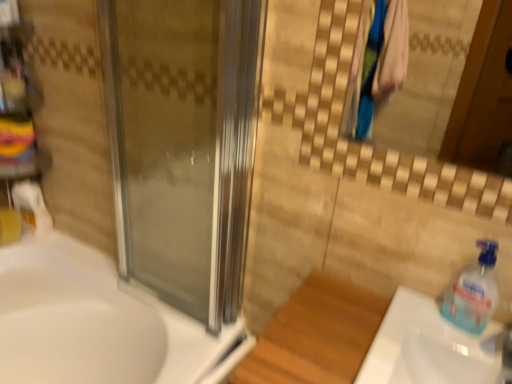
Describe the element at coordinates (430, 347) in the screenshot. This screenshot has width=512, height=384. I see `white glossy sink at lower right, the second sink in the back-to-front sequence` at that location.

I want to click on white glossy sink at lower right, which is counted as the 2th sink, starting from the left, so point(430,347).

The width and height of the screenshot is (512, 384). Describe the element at coordinates (472, 292) in the screenshot. I see `transparent plastic soap dispenser at right` at that location.

I want to click on transparent plastic soap dispenser at right, so click(x=472, y=292).

What do you see at coordinates (98, 323) in the screenshot? The height and width of the screenshot is (384, 512). I see `white glossy sink at lower left, arranged as the 2th sink when viewed from the right` at bounding box center [98, 323].

Locate an element on the screen. Image resolution: width=512 pixels, height=384 pixels. white glossy sink at lower right, the 1th sink in the right-to-left sequence is located at coordinates (430, 347).

Between white glossy sink at lower left, which is the second sink from front to back, and transparent glass screen door at center, which one is positioned in front?

Positioned in front is transparent glass screen door at center.

Does white glossy sink at lower left, the 1th sink in the left-to-right sequence, have a larger size compared to transparent glass screen door at center?

Yes.

Are white glossy sink at lower left, the 1th sink in the left-to-right sequence, and transparent glass screen door at center beside each other?

There is a gap between white glossy sink at lower left, the 1th sink in the left-to-right sequence, and transparent glass screen door at center.

Which object is positioned more to the left, transparent glass screen door at center or white glossy sink at lower right, the second sink in the back-to-front sequence?

transparent glass screen door at center is more to the left.

You are a GUI agent. You are given a task and a screenshot of the screen. Output one action in this format:
    pyautogui.click(x=<x>, y=<y>)
    Task: Click on the 1st sink below when counting from the transparent glass screen door at center (from the image's perspective)
    
    Given the screenshot: What is the action you would take?
    pyautogui.click(x=430, y=347)

Looking at the image, does transparent glass screen door at center seem bigger or smaller compared to white glossy sink at lower right, the first sink viewed from the front?

transparent glass screen door at center is bigger than white glossy sink at lower right, the first sink viewed from the front.

Does transparent glass screen door at center come in front of white glossy sink at lower right, the second sink in the back-to-front sequence?

No, transparent glass screen door at center is further to the viewer.

From a real-world perspective, is transparent glass screen door at center physically below white glossy sink at lower left, marked as the 1th sink in a back-to-front arrangement?

Actually, transparent glass screen door at center is physically above white glossy sink at lower left, marked as the 1th sink in a back-to-front arrangement, in the real world.

Is point (233, 21) farther from camera compared to point (50, 275)?

No, (233, 21) is in front of (50, 275).

Is transparent glass screen door at center directly adjacent to white glossy sink at lower left, which is the second sink from front to back?

There is a gap between transparent glass screen door at center and white glossy sink at lower left, which is the second sink from front to back.

Is transparent glass screen door at center thinner than white glossy sink at lower left, arranged as the 2th sink when viewed from the right?

Yes.

Is white glossy sink at lower right, the second sink in the back-to-front sequence, outside of transparent plastic soap dispenser at right?

That's correct, white glossy sink at lower right, the second sink in the back-to-front sequence, is outside of transparent plastic soap dispenser at right.

Are white glossy sink at lower right, the 1th sink in the right-to-left sequence, and transparent plastic soap dispenser at right located far from each other?

No, white glossy sink at lower right, the 1th sink in the right-to-left sequence, is not far away from transparent plastic soap dispenser at right.

Considering the positions of point (425, 342) and point (495, 294), is point (425, 342) closer or farther from the camera than point (495, 294)?

Point (425, 342) appears to be farther away from the viewer than point (495, 294).

From a real-world perspective, is white glossy sink at lower left, arranged as the 2th sink when viewed from the right, over white glossy sink at lower right, the 1th sink in the right-to-left sequence?

Incorrect, from a real-world perspective, white glossy sink at lower left, arranged as the 2th sink when viewed from the right, is lower than white glossy sink at lower right, the 1th sink in the right-to-left sequence.

Is white glossy sink at lower left, marked as the 1th sink in a back-to-front arrangement, smaller than white glossy sink at lower right, the second sink in the back-to-front sequence?

No, white glossy sink at lower left, marked as the 1th sink in a back-to-front arrangement, is not smaller than white glossy sink at lower right, the second sink in the back-to-front sequence.

Which object is wider, white glossy sink at lower left, arranged as the 2th sink when viewed from the right, or white glossy sink at lower right, the second sink in the back-to-front sequence?

Wider between the two is white glossy sink at lower left, arranged as the 2th sink when viewed from the right.

Would you say white glossy sink at lower left, which is the second sink from front to back, is a long distance from white glossy sink at lower right, which is counted as the 2th sink, starting from the left?

No, white glossy sink at lower left, which is the second sink from front to back, is not far away from white glossy sink at lower right, which is counted as the 2th sink, starting from the left.

From the picture: Measure the distance between transparent glass screen door at center and transparent plastic soap dispenser at right.

They are 71.94 centimeters apart.

Can you confirm if transparent glass screen door at center is thinner than transparent plastic soap dispenser at right?

No, transparent glass screen door at center is not thinner than transparent plastic soap dispenser at right.

In the scene shown: From a real-world perspective, is transparent glass screen door at center physically above transparent plastic soap dispenser at right?

Correct, in the physical world, transparent glass screen door at center is higher than transparent plastic soap dispenser at right.

Does transparent glass screen door at center touch transparent plastic soap dispenser at right?

transparent glass screen door at center and transparent plastic soap dispenser at right are not in contact.

Is white glossy sink at lower left, the 1th sink in the left-to-right sequence, at the back of transparent plastic soap dispenser at right?

That's not correct — transparent plastic soap dispenser at right is not looking away from white glossy sink at lower left, the 1th sink in the left-to-right sequence.

Does transparent plastic soap dispenser at right have a greater height compared to white glossy sink at lower left, which is the second sink from front to back?

In fact, transparent plastic soap dispenser at right may be shorter than white glossy sink at lower left, which is the second sink from front to back.

Where is `cleaning product above the white glossy sink at lower left, marked as the 1th sink in a back-to-front arrangement (from the image's perspective)`? cleaning product above the white glossy sink at lower left, marked as the 1th sink in a back-to-front arrangement (from the image's perspective) is located at coordinates (472, 292).

Is there a large distance between transparent plastic soap dispenser at right and white glossy sink at lower left, which is the second sink from front to back?

No, transparent plastic soap dispenser at right is in close proximity to white glossy sink at lower left, which is the second sink from front to back.

There is a transparent glass screen door at center. Find the location of `the 2nd sink below it (from a real-world perspective)`. the 2nd sink below it (from a real-world perspective) is located at coordinates (98, 323).

Where is `screen door located above the white glossy sink at lower right, the 1th sink in the right-to-left sequence (from the image's perspective)`? screen door located above the white glossy sink at lower right, the 1th sink in the right-to-left sequence (from the image's perspective) is located at coordinates (183, 145).

When comparing their distances from transparent glass screen door at center, does white glossy sink at lower left, marked as the 1th sink in a back-to-front arrangement, or white glossy sink at lower right, the 1th sink in the right-to-left sequence, seem closer?

Based on the image, white glossy sink at lower left, marked as the 1th sink in a back-to-front arrangement, appears to be nearer to transparent glass screen door at center.

Considering their positions, is white glossy sink at lower right, the 1th sink in the right-to-left sequence, positioned further to transparent plastic soap dispenser at right than white glossy sink at lower left, arranged as the 2th sink when viewed from the right?

white glossy sink at lower left, arranged as the 2th sink when viewed from the right.

Based on their spatial positions, is transparent glass screen door at center or white glossy sink at lower right, the first sink viewed from the front, closer to white glossy sink at lower left, arranged as the 2th sink when viewed from the right?

Based on the image, transparent glass screen door at center appears to be nearer to white glossy sink at lower left, arranged as the 2th sink when viewed from the right.

From the image, which object appears to be farther from white glossy sink at lower right, the first sink viewed from the front, transparent plastic soap dispenser at right or transparent glass screen door at center?

The object further to white glossy sink at lower right, the first sink viewed from the front, is transparent glass screen door at center.

Considering their positions, is white glossy sink at lower right, the second sink in the back-to-front sequence, positioned closer to transparent glass screen door at center than transparent plastic soap dispenser at right?

Based on the image, white glossy sink at lower right, the second sink in the back-to-front sequence, appears to be nearer to transparent glass screen door at center.

Which object lies further to the anchor point white glossy sink at lower left, which is the second sink from front to back, transparent plastic soap dispenser at right or white glossy sink at lower right, the second sink in the back-to-front sequence?

transparent plastic soap dispenser at right lies further to white glossy sink at lower left, which is the second sink from front to back, than the other object.

Which object lies nearer to the anchor point transparent plastic soap dispenser at right, transparent glass screen door at center or white glossy sink at lower left, arranged as the 2th sink when viewed from the right?

transparent glass screen door at center lies closer to transparent plastic soap dispenser at right than the other object.

Which object lies further to the anchor point white glossy sink at lower left, marked as the 1th sink in a back-to-front arrangement, white glossy sink at lower right, which is counted as the 2th sink, starting from the left, or transparent plastic soap dispenser at right?

The object further to white glossy sink at lower left, marked as the 1th sink in a back-to-front arrangement, is transparent plastic soap dispenser at right.

Find the location of a particular element. sink between white glossy sink at lower left, arranged as the 2th sink when viewed from the right, and transparent plastic soap dispenser at right is located at coordinates (430, 347).

Where is `sink located between transparent glass screen door at center and transparent plastic soap dispenser at right in the left-right direction`? sink located between transparent glass screen door at center and transparent plastic soap dispenser at right in the left-right direction is located at coordinates (430, 347).

The width and height of the screenshot is (512, 384). I want to click on screen door situated between white glossy sink at lower left, which is the second sink from front to back, and transparent plastic soap dispenser at right from left to right, so click(x=183, y=145).

Locate an element on the screen. This screenshot has width=512, height=384. screen door between white glossy sink at lower left, arranged as the 2th sink when viewed from the right, and white glossy sink at lower right, the 1th sink in the right-to-left sequence, from left to right is located at coordinates (183, 145).